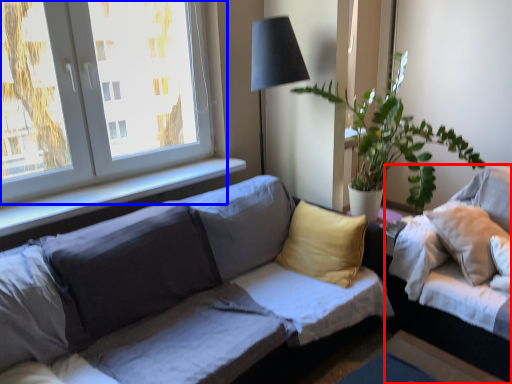
Question: Among these objects, which one is farthest to the camera, studio couch (highlighted by a red box) or window (highlighted by a blue box)?

Choices:
 (A) studio couch
 (B) window

Answer: (B)